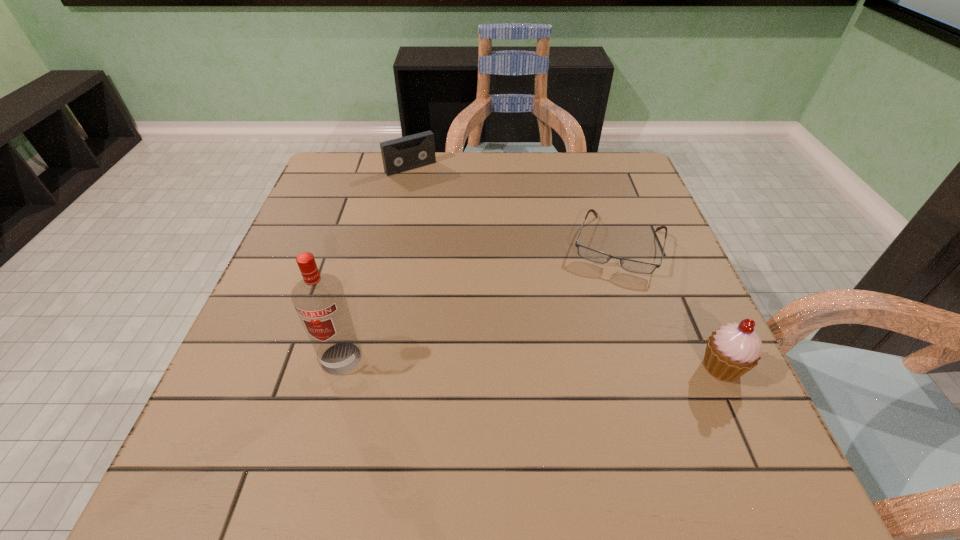
In order to click on the tallest object in this screenshot , I will do `click(319, 299)`.

Identify the location of cupcake. (731, 351).

Locate an element on the screen. the third nearest object is located at coordinates (590, 254).

Where is `spectacles`? spectacles is located at coordinates (590, 254).

Locate an element on the screen. The height and width of the screenshot is (540, 960). the third tallest object is located at coordinates (398, 155).

Where is `the farthest object`? The image size is (960, 540). the farthest object is located at coordinates (398, 155).

The image size is (960, 540). What are the coordinates of `vacant space located on the front label of the tallest object` in the screenshot? It's located at (328, 407).

Identify the location of free space located 0.130m on the left of the second tallest object. The width and height of the screenshot is (960, 540). (627, 367).

I want to click on free space located 0.350m on the front-facing side of the spectacles, so click(x=568, y=413).

At what (x,y) coordinates should I click in order to perform the action: click on free spot located on the front-facing side of the spectacles. Please return your answer as a coordinate pair (x, y). Looking at the image, I should click on (588, 345).